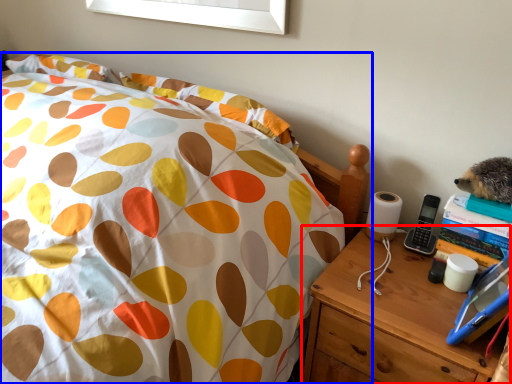
Question: Among these objects, which one is farthest to the camera, nightstand (highlighted by a red box) or bed (highlighted by a blue box)?

Choices:
 (A) nightstand
 (B) bed

Answer: (A)